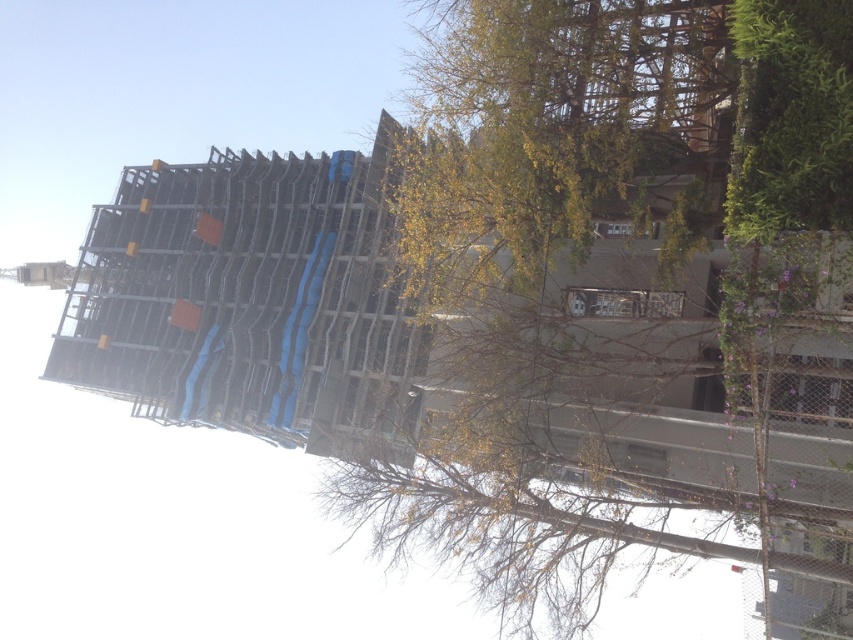
You are an architect reviewing the construction site image. You need to determine the exact 2D coordinates of the green leafy tree at upper center to ensure it doesn not obstruct the building facade. What are the coordinates?

The green leafy tree at upper center is located at coordinates (624, 300).